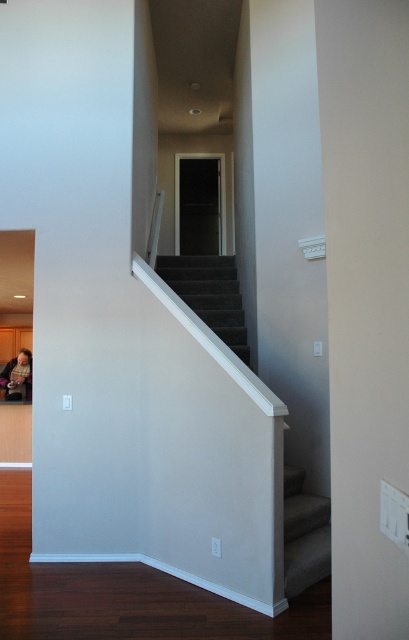
Which is below, carpeted stairs at center or suede-like gray stair at lower right?

suede-like gray stair at lower right is below.

What do you see at coordinates (209, 294) in the screenshot?
I see `carpeted stairs at center` at bounding box center [209, 294].

Between point (330, 564) and point (318, 577), which one is positioned in front?

Point (318, 577)

Identify the location of carpeted stairs at center. The height and width of the screenshot is (640, 409). (209, 294).

Is dark gray carpeted stairs at center to the right of suede-like gray stair at lower right from the viewer's perspective?

In fact, dark gray carpeted stairs at center is to the left of suede-like gray stair at lower right.

Where is `dark gray carpeted stairs at center`? This screenshot has width=409, height=640. dark gray carpeted stairs at center is located at coordinates (209, 294).

Can you confirm if carpeted stairs at center is positioned to the left of dark gray carpeted stairs at center?

Indeed, carpeted stairs at center is positioned on the left side of dark gray carpeted stairs at center.

Does carpeted stairs at center lie behind dark gray carpeted stairs at center?

No, carpeted stairs at center is in front of dark gray carpeted stairs at center.

Which is in front, point (294, 499) or point (229, 308)?

Point (294, 499) is in front.

Where is `carpeted stairs at center`? The height and width of the screenshot is (640, 409). carpeted stairs at center is located at coordinates (209, 294).